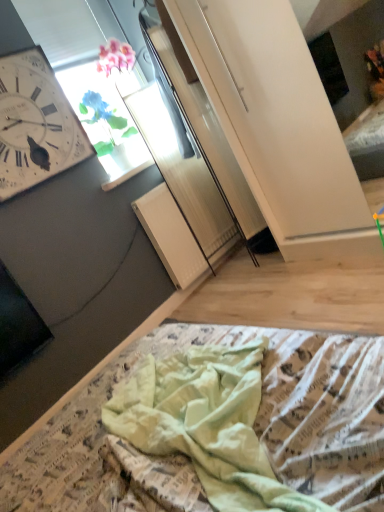
Question: Considering the relative sizes of light green fabric at lower center and white wooden wall clock at upper left in the image provided, is light green fabric at lower center smaller than white wooden wall clock at upper left?

Choices:
 (A) no
 (B) yes

Answer: (A)

Question: Considering the relative sizes of light green fabric at lower center and white wooden wall clock at upper left in the image provided, is light green fabric at lower center shorter than white wooden wall clock at upper left?

Choices:
 (A) yes
 (B) no

Answer: (A)

Question: Is light green fabric at lower center positioned far away from white wooden wall clock at upper left?

Choices:
 (A) yes
 (B) no

Answer: (A)

Question: Does light green fabric at lower center touch white wooden wall clock at upper left?

Choices:
 (A) no
 (B) yes

Answer: (A)

Question: From the image's perspective, is light green fabric at lower center above white wooden wall clock at upper left?

Choices:
 (A) yes
 (B) no

Answer: (B)

Question: From a real-world perspective, does light green fabric at lower center sit lower than white wooden wall clock at upper left?

Choices:
 (A) yes
 (B) no

Answer: (A)

Question: Could you tell me if transparent glass window at upper center is turned towards light green fabric at lower center?

Choices:
 (A) no
 (B) yes

Answer: (A)

Question: Considering the relative sizes of transparent glass window at upper center and light green fabric at lower center in the image provided, is transparent glass window at upper center bigger than light green fabric at lower center?

Choices:
 (A) yes
 (B) no

Answer: (B)

Question: Could light green fabric at lower center be considered to be inside transparent glass window at upper center?

Choices:
 (A) yes
 (B) no

Answer: (B)

Question: Is transparent glass window at upper center thinner than light green fabric at lower center?

Choices:
 (A) yes
 (B) no

Answer: (A)

Question: Is there a large distance between transparent glass window at upper center and light green fabric at lower center?

Choices:
 (A) yes
 (B) no

Answer: (A)

Question: Does transparent glass window at upper center have a lesser height compared to light green fabric at lower center?

Choices:
 (A) yes
 (B) no

Answer: (B)

Question: From the image's perspective, is transparent glass window at upper center located beneath white wooden wall clock at upper left?

Choices:
 (A) no
 (B) yes

Answer: (A)